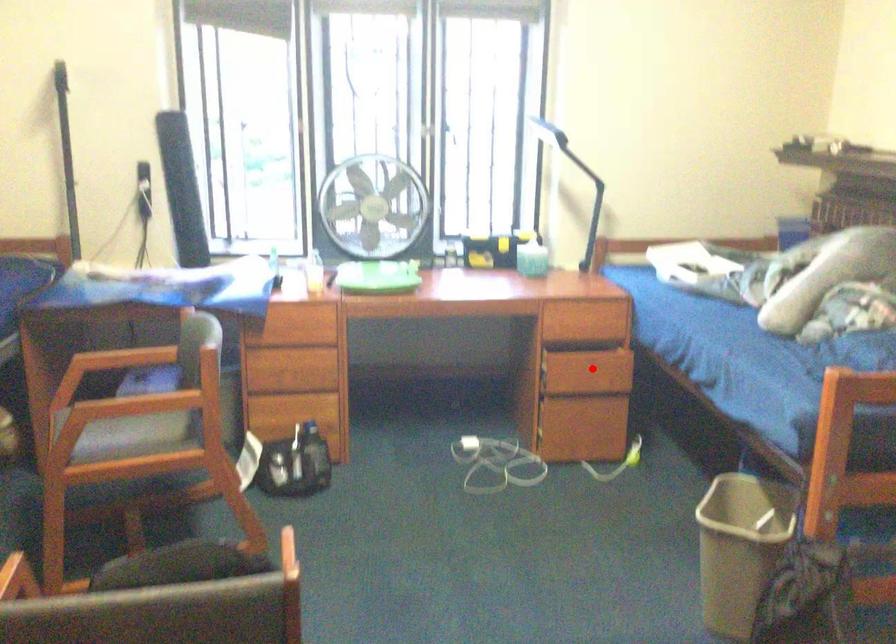
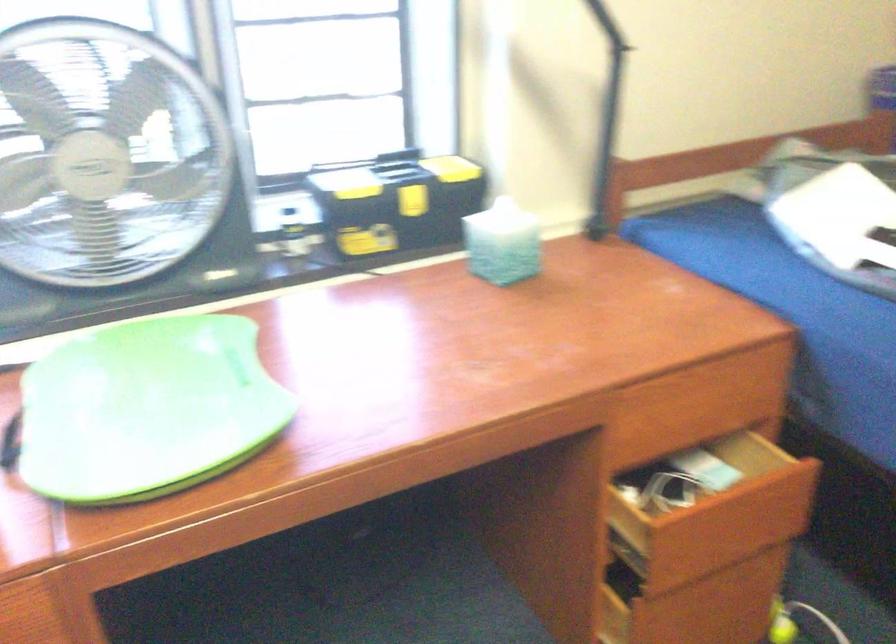
Question: I am providing you with two images of the same scene from different viewpoints. In image1, a red point is highlighted. Considering the same 3D point in image2, which of the following is correct?

Choices:
 (A) It is closer
 (B) It is farther

Answer: (A)